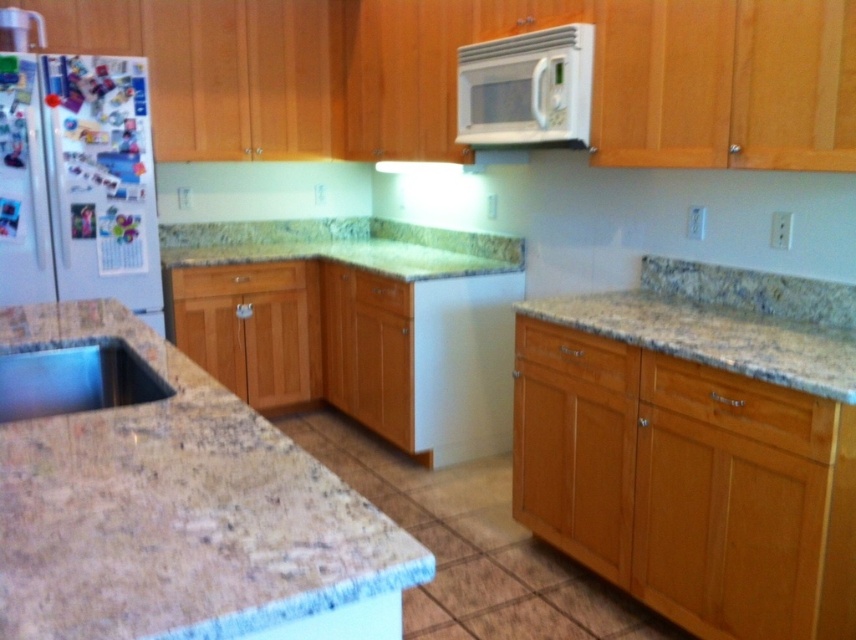
You need to place a large cutting board on either the granite at right or the satin silver sink at lower left. Which surface has enough space for it?

The granite at right is wider than the satin silver sink at lower left, so it likely has more space to accommodate the large cutting board.

You are standing in the kitchen and want to reach both the point at [373,628] and the point at [473,128]. Which point will you reach first?

You will reach the point at [373,628] first because it is closer to you than the point at [473,128].

You are a chef preparing to place a hot dish on a surface in the kitchen. You have two options available in the scene, the granite countertop at lower left and the white glossy microwave at upper center. Which surface would be more stable for placing a heavy object?

The granite countertop at lower left has a greater height compared to the white glossy microwave at upper center, so it would provide a more stable surface for placing a heavy object.